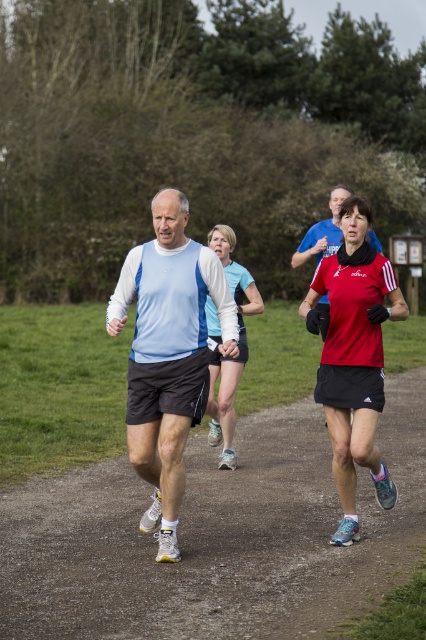
You are a photographer standing at the starting line of a race. You want to take a photo of the light blue fabric shirt at center and the matte blue shirt at center. Which runner should you focus on first to ensure both are in focus?

The light blue fabric shirt at center is closer to the viewer than the matte blue shirt at center, so focus on the light blue fabric shirt at center first to ensure both are in focus.